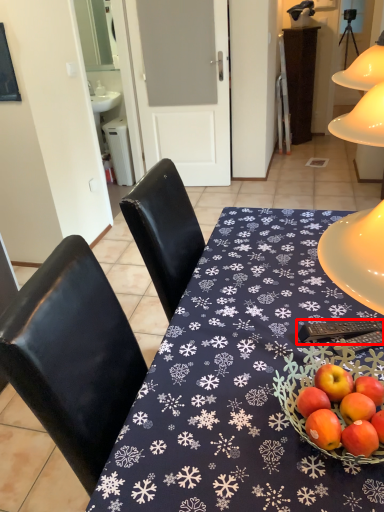
Question: From the image's perspective, what is the correct spatial relationship of remote control (annotated by the red box) in relation to desk?

Choices:
 (A) below
 (B) above

Answer: (B)